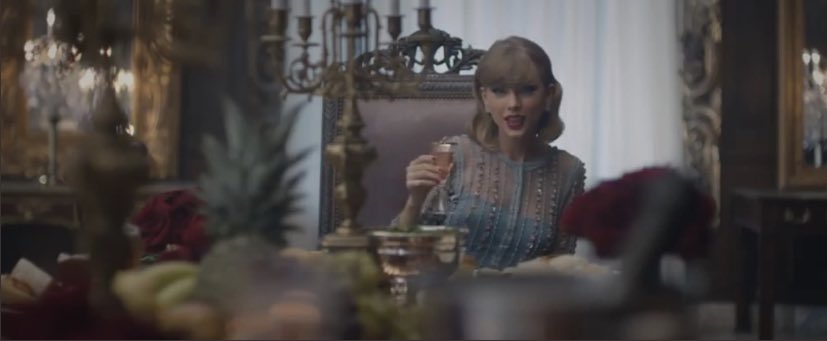
Identify the location of curtains. (613, 102).